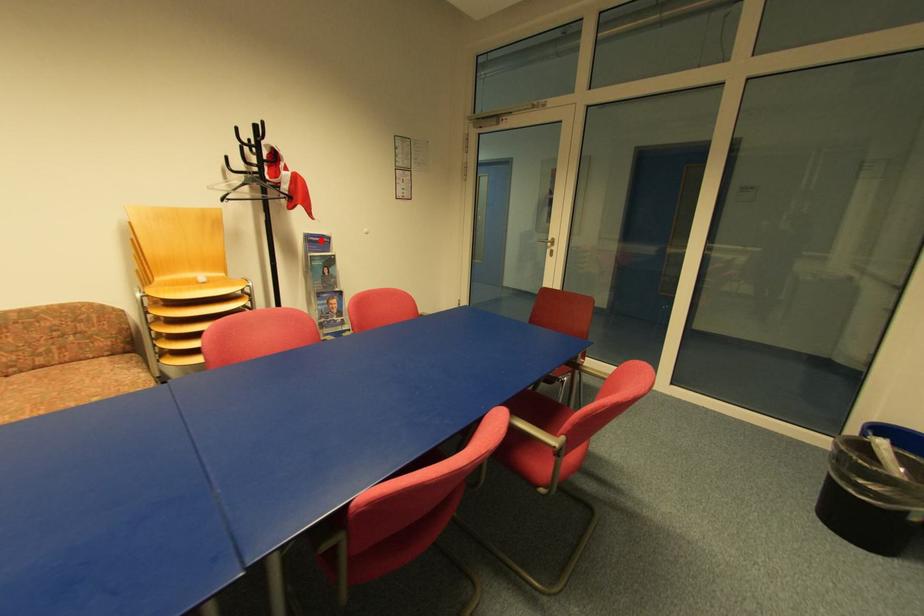
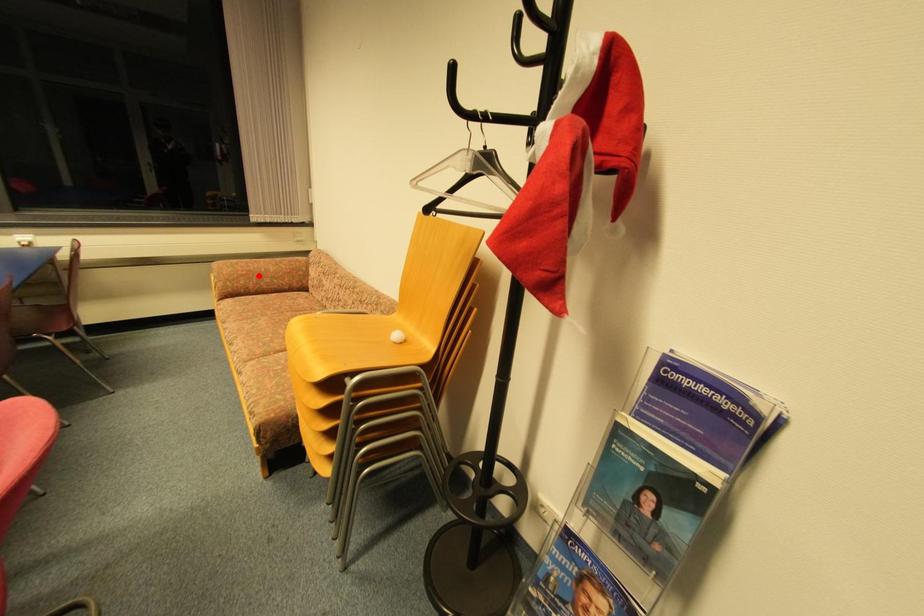
I am providing you with two images of the same scene from different viewpoints. A red point is marked on the first image and another point is marked on the second image. Is the marked point in image1 the same physical position as the marked point in image2?

No